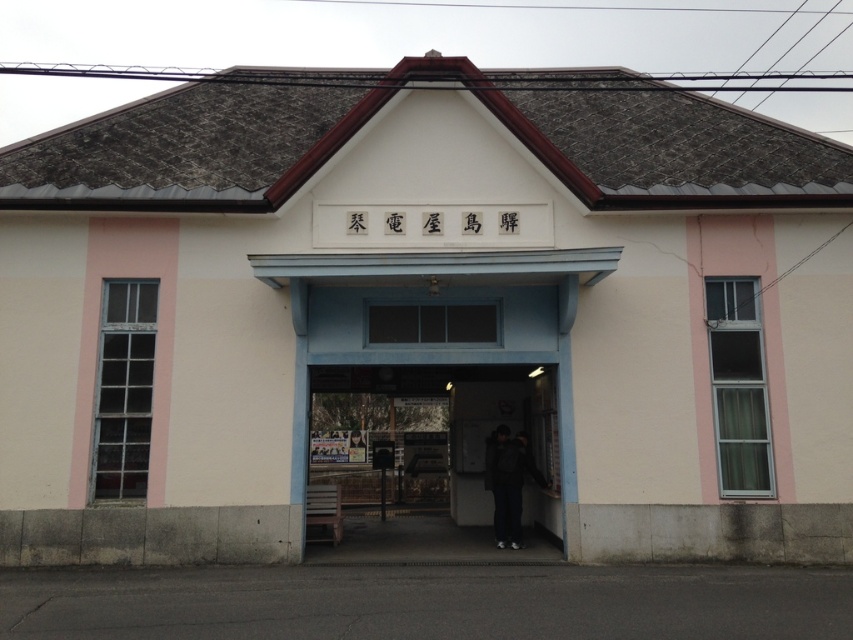
You are standing at the entrance of the train station and see two points marked on the wall. The first point is at coordinate point (x=518, y=417) and the second is at point (x=519, y=493). Which point is closer to you?

Point (x=519, y=493) is closer to you because it is less further to the camera than point (x=518, y=417).

You are standing outside the train station entrance and see the matte concrete entrance at center and the dark gray jacket at center. Which object is positioned to the left of the other?

The matte concrete entrance at center is to the left of the dark gray jacket at center.